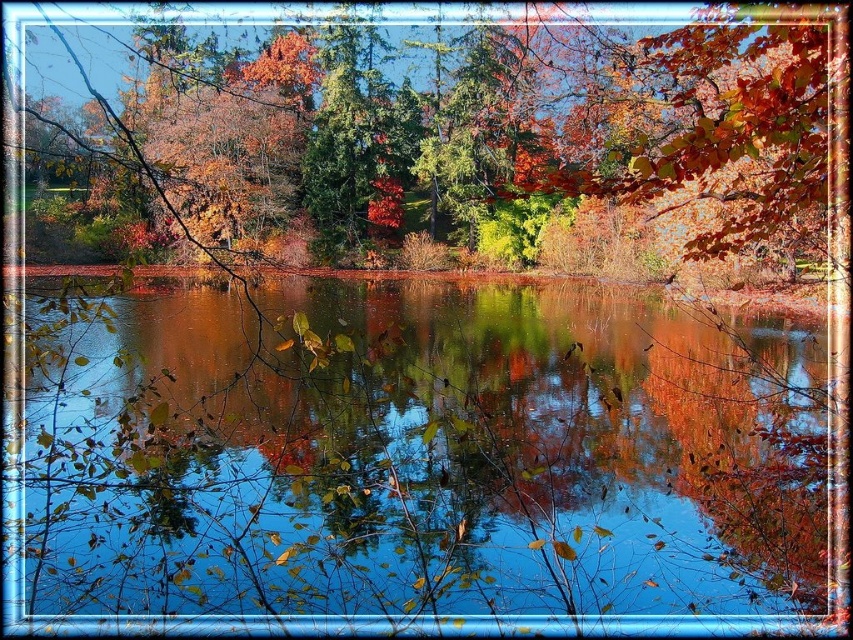
Does transparent water at center appear on the left side of autumn leaves at center?

No, transparent water at center is not to the left of autumn leaves at center.

Describe the element at coordinates (410, 464) in the screenshot. Image resolution: width=853 pixels, height=640 pixels. I see `transparent water at center` at that location.

The image size is (853, 640). What are the coordinates of `transparent water at center` in the screenshot? It's located at (410, 464).

Locate an element on the screen. The height and width of the screenshot is (640, 853). transparent water at center is located at coordinates (410, 464).